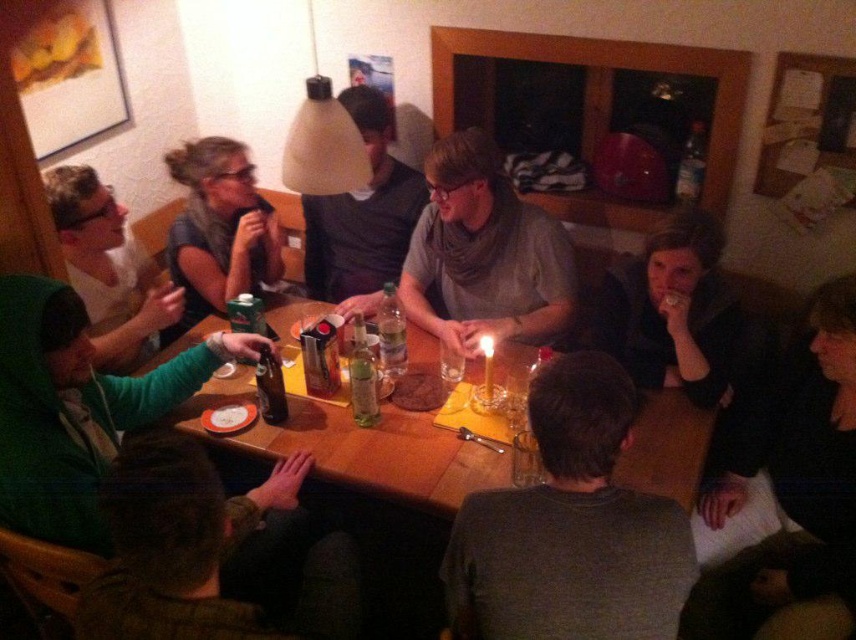
Question: From the image, what is the correct spatial relationship of black fabric jacket at lower right in relation to matte gray shirt at upper left?

Choices:
 (A) left
 (B) right

Answer: (B)

Question: Estimate the real-world distances between objects in this image. Which object is farther from the matte gray sweater at center?

Choices:
 (A) black fabric jacket at lower right
 (B) matte gray shirt at upper left
 (C) black fabric at lower right

Answer: (C)

Question: Observing the image, what is the correct spatial positioning of wooden table at center in reference to green matte shirt at left?

Choices:
 (A) above
 (B) below

Answer: (B)

Question: In this image, where is wooden table at center located relative to brown glass bottle at center?

Choices:
 (A) above
 (B) below

Answer: (A)

Question: Which object is closer to the camera taking this photo?

Choices:
 (A) dark green sweater at lower left
 (B) green matte shirt at left
 (C) smooth chocolate cake at center

Answer: (A)

Question: Which point is closer to the camera?

Choices:
 (A) (125, 554)
 (B) (28, 500)

Answer: (A)